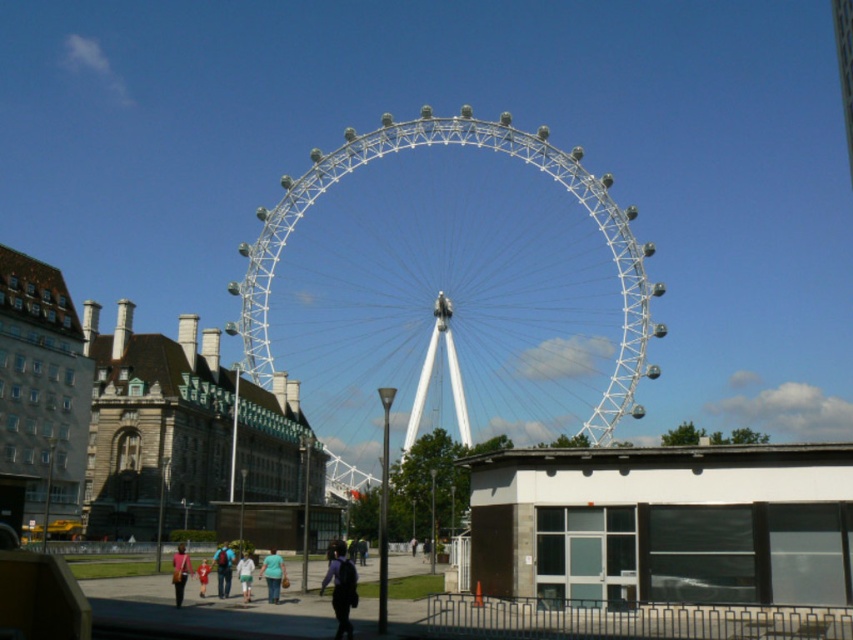
Can you confirm if white metallic ferris wheel at center is smaller than light blue jeans at center?

Incorrect, white metallic ferris wheel at center is not smaller in size than light blue jeans at center.

The image size is (853, 640). Describe the element at coordinates (480, 147) in the screenshot. I see `white metallic ferris wheel at center` at that location.

Which is in front, point (590, 432) or point (270, 554)?

Positioned in front is point (270, 554).

At what (x,y) coordinates should I click in order to perform the action: click on white metallic ferris wheel at center. Please return your answer as a coordinate pair (x, y). This screenshot has width=853, height=640. Looking at the image, I should click on (480, 147).

Who is positioned more to the right, matte pink backpack at lower left or red cotton shirt at lower center?

From the viewer's perspective, red cotton shirt at lower center appears more on the right side.

Which is in front, point (183, 589) or point (204, 577)?

Point (204, 577)

Locate an element on the screen. matte pink backpack at lower left is located at coordinates (180, 572).

Who is lower down, white metallic ferris wheel at center or dark blue backpack at lower center?

dark blue backpack at lower center

Is white metallic ferris wheel at center taller than dark blue backpack at lower center?

Yes, white metallic ferris wheel at center is taller than dark blue backpack at lower center.

Locate an element on the screen. white metallic ferris wheel at center is located at coordinates pos(480,147).